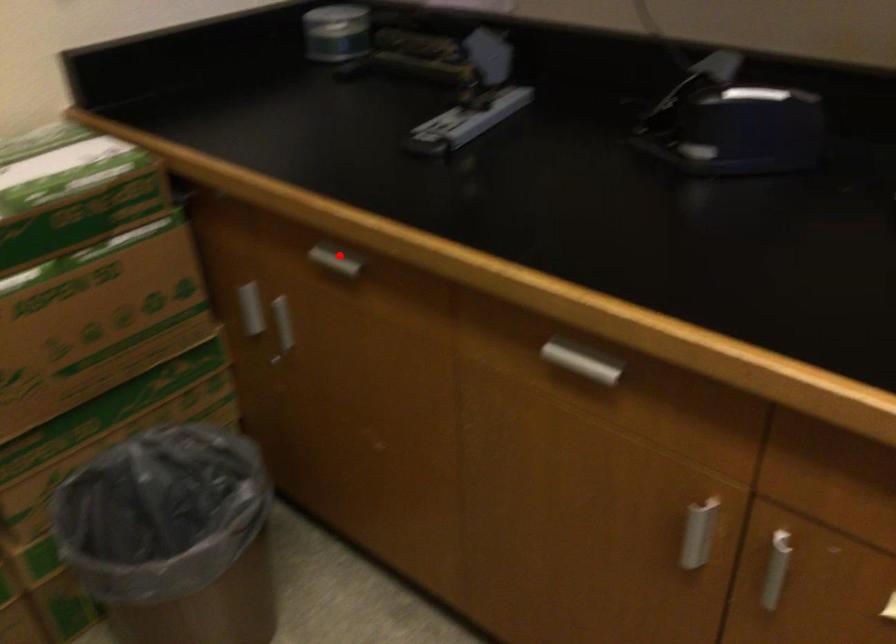
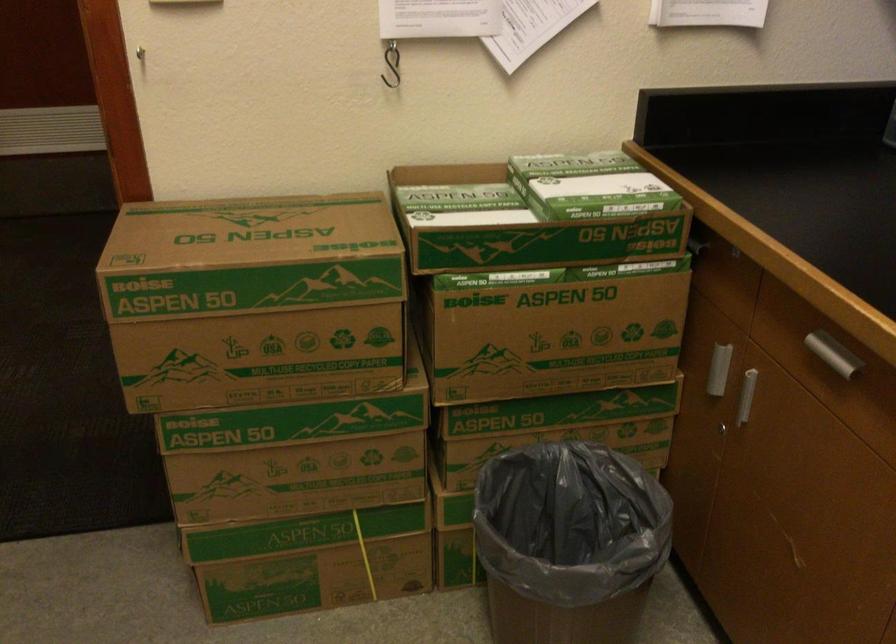
Question: I am providing you with two images of the same scene from different viewpoints. Image1 has a red point marked. In image2, the corresponding 3D location appears at what relative position? Reply with the corresponding letter.

Choices:
 (A) Closer
 (B) Farther

Answer: (A)